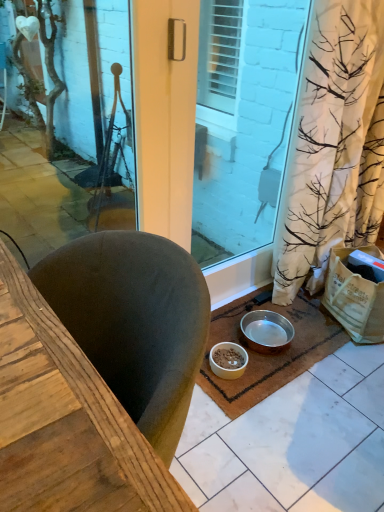
Question: Does white matte bowl at lower center, the first bowl when ordered from left to right, have a greater height compared to metallic silver bowl at lower center, which appears as the 2th bowl when viewed from the left?

Choices:
 (A) yes
 (B) no

Answer: (B)

Question: Does white matte bowl at lower center, arranged as the 2th bowl when viewed from the right, appear on the right side of metallic silver bowl at lower center, placed as the first bowl when sorted from right to left?

Choices:
 (A) yes
 (B) no

Answer: (B)

Question: Is white matte bowl at lower center, arranged as the 2th bowl when viewed from the right, positioned with its back to metallic silver bowl at lower center, placed as the first bowl when sorted from right to left?

Choices:
 (A) no
 (B) yes

Answer: (A)

Question: Does white matte bowl at lower center, arranged as the 2th bowl when viewed from the right, turn towards metallic silver bowl at lower center, placed as the first bowl when sorted from right to left?

Choices:
 (A) no
 (B) yes

Answer: (A)

Question: From the image's perspective, would you say white matte bowl at lower center, arranged as the 2th bowl when viewed from the right, is positioned over metallic silver bowl at lower center, placed as the first bowl when sorted from right to left?

Choices:
 (A) yes
 (B) no

Answer: (B)

Question: Looking at their shapes, would you say white matte bowl at lower center, arranged as the 2th bowl when viewed from the right, is wider or thinner than transparent glass screen door at center?

Choices:
 (A) thin
 (B) wide

Answer: (B)

Question: Is white matte bowl at lower center, arranged as the 2th bowl when viewed from the right, spatially inside transparent glass screen door at center, or outside of it?

Choices:
 (A) outside
 (B) inside

Answer: (A)

Question: From a real-world perspective, is white matte bowl at lower center, arranged as the 2th bowl when viewed from the right, positioned above or below transparent glass screen door at center?

Choices:
 (A) below
 (B) above

Answer: (A)

Question: Is point (221, 344) positioned closer to the camera than point (286, 86)?

Choices:
 (A) closer
 (B) farther

Answer: (A)

Question: Considering the positions of brown coir mat at lower center and transparent glass screen door at center in the image, is brown coir mat at lower center wider or thinner than transparent glass screen door at center?

Choices:
 (A) wide
 (B) thin

Answer: (A)

Question: Is point [246, 347] closer or farther from the camera than point [225, 135]?

Choices:
 (A) closer
 (B) farther

Answer: (A)

Question: Based on their sizes in the image, would you say brown coir mat at lower center is bigger or smaller than transparent glass screen door at center?

Choices:
 (A) big
 (B) small

Answer: (B)

Question: In the image, is brown coir mat at lower center on the left side or the right side of transparent glass screen door at center?

Choices:
 (A) right
 (B) left

Answer: (A)

Question: Is metallic silver bowl at lower center, which appears as the 2th bowl when viewed from the left, inside or outside of transparent glass screen door at center?

Choices:
 (A) outside
 (B) inside

Answer: (A)

Question: From the image's perspective, is metallic silver bowl at lower center, placed as the first bowl when sorted from right to left, above or below transparent glass screen door at center?

Choices:
 (A) below
 (B) above

Answer: (A)